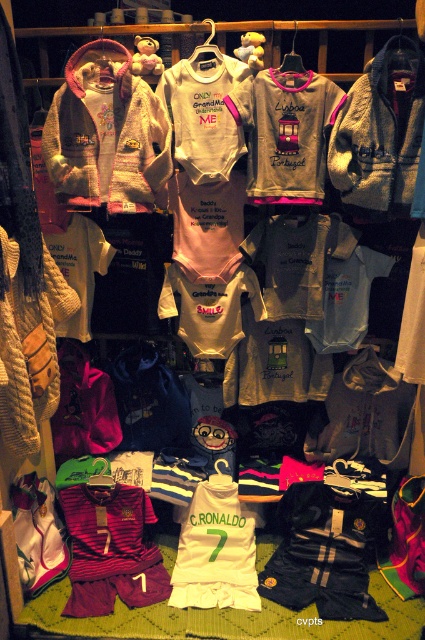
Question: Which point appears closest to the camera in this image?

Choices:
 (A) (99, 609)
 (B) (214, 564)

Answer: (A)

Question: Which of the following is the farthest from the observer?

Choices:
 (A) white jersey at center
 (B) bright maroon jersey at center

Answer: (A)

Question: Among these objects, which one is nearest to the camera?

Choices:
 (A) bright maroon jersey at center
 (B) white jersey at center

Answer: (A)

Question: Does bright maroon jersey at center lie behind white jersey at center?

Choices:
 (A) yes
 (B) no

Answer: (B)

Question: Can you confirm if bright maroon jersey at center is positioned to the right of white jersey at center?

Choices:
 (A) no
 (B) yes

Answer: (A)

Question: Is bright maroon jersey at center closer to camera compared to white jersey at center?

Choices:
 (A) no
 (B) yes

Answer: (B)